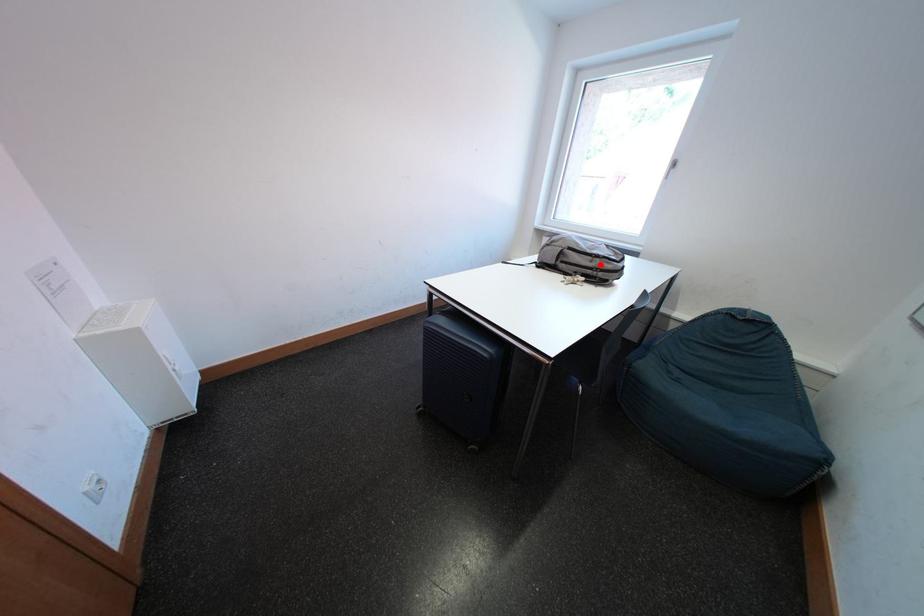
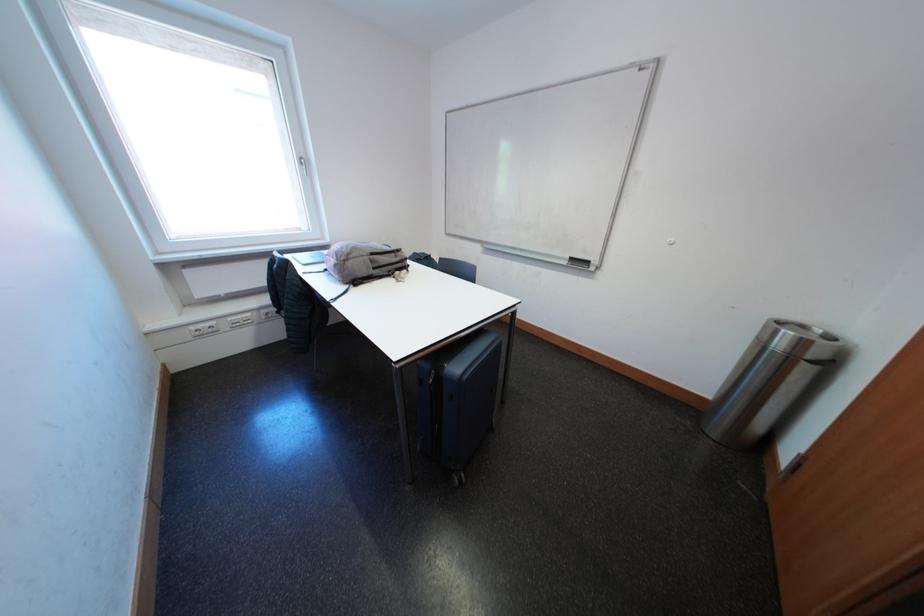
Where in the second image is the point corresponding to the highlighted location from the first image?

(406, 261)